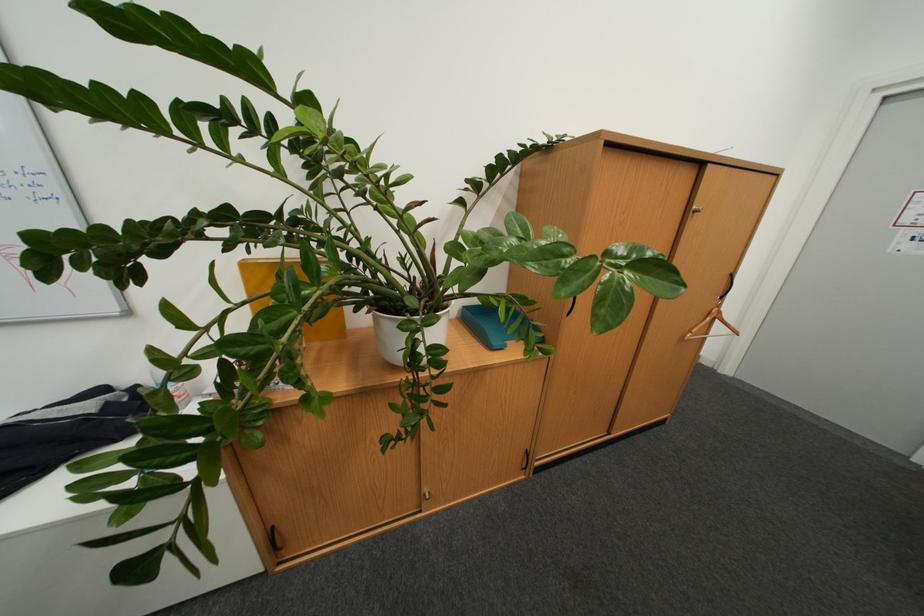
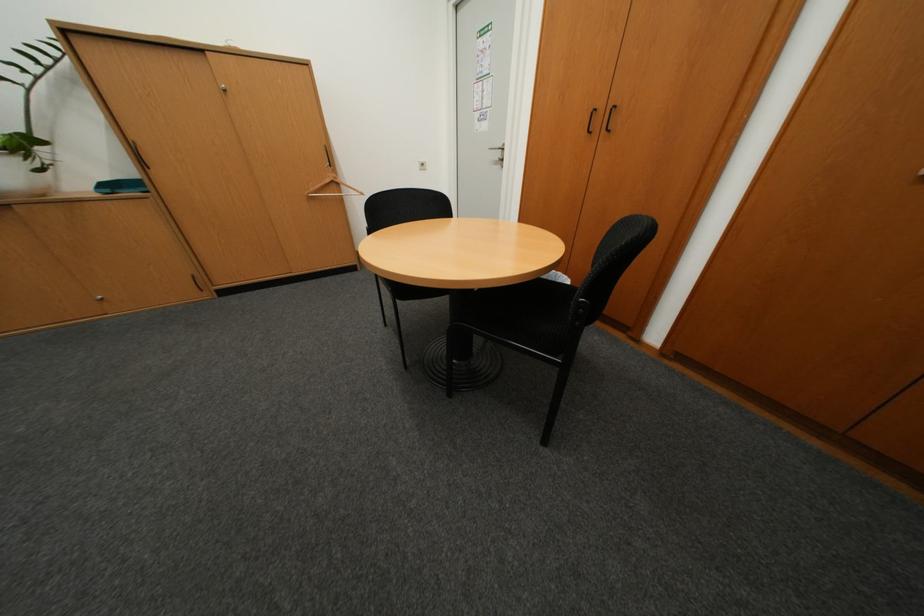
The images are taken continuously from a first-person perspective. In which direction are you moving?

The cameraman walked toward right, backward.